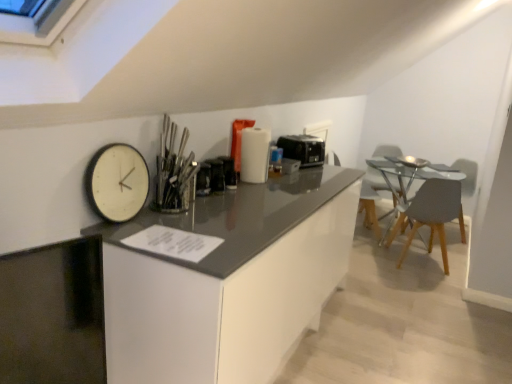
Question: Considering the relative positions of polished metal utensils at center and white plastic swivel chair at right in the image provided, is polished metal utensils at center to the left of white plastic swivel chair at right from the viewer's perspective?

Choices:
 (A) yes
 (B) no

Answer: (A)

Question: Considering the relative sizes of polished metal utensils at center and white plastic swivel chair at right in the image provided, is polished metal utensils at center shorter than white plastic swivel chair at right?

Choices:
 (A) no
 (B) yes

Answer: (B)

Question: From the image's perspective, does polished metal utensils at center appear lower than white plastic swivel chair at right?

Choices:
 (A) yes
 (B) no

Answer: (B)

Question: Can you confirm if polished metal utensils at center is wider than white plastic swivel chair at right?

Choices:
 (A) yes
 (B) no

Answer: (B)

Question: Would you consider polished metal utensils at center to be distant from white plastic swivel chair at right?

Choices:
 (A) no
 (B) yes

Answer: (B)

Question: Is polished metal utensils at center turned away from white plastic swivel chair at right?

Choices:
 (A) yes
 (B) no

Answer: (B)

Question: Is white plastic swivel chair at right completely or partially inside matte gray armchair at right?

Choices:
 (A) yes
 (B) no

Answer: (B)

Question: Does matte gray armchair at right have a lesser width compared to white plastic swivel chair at right?

Choices:
 (A) no
 (B) yes

Answer: (B)

Question: Considering the relative positions of matte gray armchair at right and white plastic swivel chair at right in the image provided, is matte gray armchair at right to the left of white plastic swivel chair at right from the viewer's perspective?

Choices:
 (A) yes
 (B) no

Answer: (B)

Question: From a real-world perspective, is matte gray armchair at right on white plastic swivel chair at right?

Choices:
 (A) yes
 (B) no

Answer: (B)

Question: Does matte gray armchair at right have a larger size compared to white plastic swivel chair at right?

Choices:
 (A) yes
 (B) no

Answer: (B)

Question: Can you confirm if matte gray armchair at right is shorter than white plastic swivel chair at right?

Choices:
 (A) yes
 (B) no

Answer: (A)

Question: Does black plastic toaster at center, marked as the first appliance in a right-to-left arrangement, contain matte gray armchair at right?

Choices:
 (A) yes
 (B) no

Answer: (B)